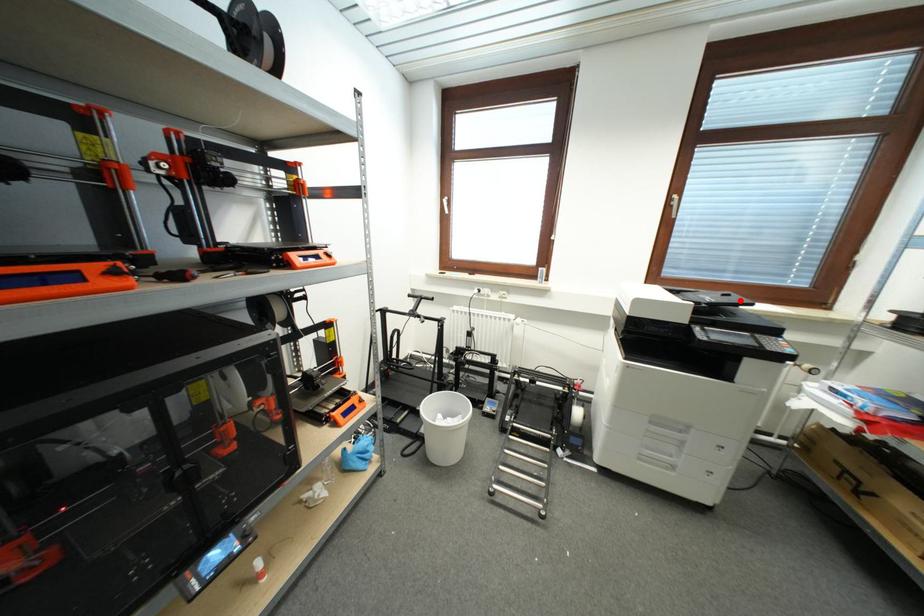
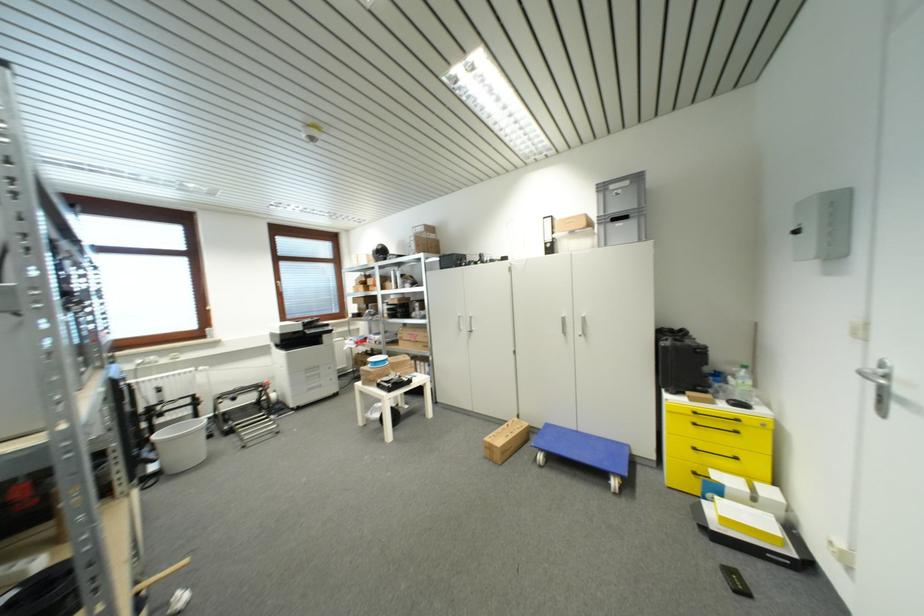
The point at the highlighted location is marked in the first image. Where is the corresponding point in the second image?

(320, 321)